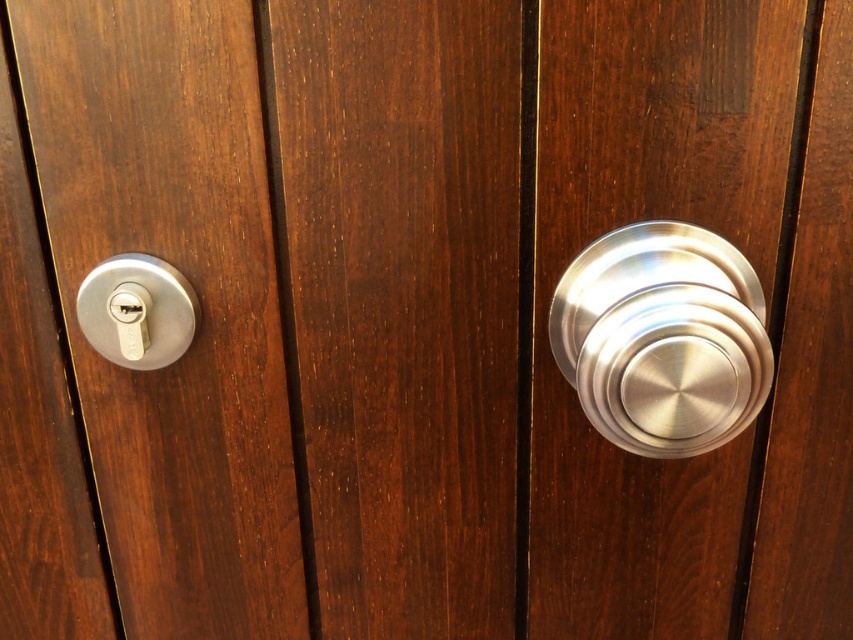
Identify the location of dark wood door at center. This screenshot has height=640, width=853. [399, 305].

Which is more to the right, dark wood door at center or satin silver door handle at right?

From the viewer's perspective, satin silver door handle at right appears more on the right side.

What do you see at coordinates (399, 305) in the screenshot? I see `dark wood door at center` at bounding box center [399, 305].

Identify the location of dark wood door at center. The image size is (853, 640). (399, 305).

Image resolution: width=853 pixels, height=640 pixels. Describe the element at coordinates (195, 291) in the screenshot. I see `satin nickel lock at left` at that location.

The image size is (853, 640). I want to click on satin nickel lock at left, so click(x=195, y=291).

Identify the location of satin nickel lock at left. The height and width of the screenshot is (640, 853). (195, 291).

Is satin silver door handle at right further to the viewer compared to matte silver lock at left?

No, it is in front of matte silver lock at left.

What do you see at coordinates (662, 339) in the screenshot? I see `satin silver door handle at right` at bounding box center [662, 339].

Who is more distant from viewer, [631,259] or [154,349]?

The point [154,349] is more distant.

This screenshot has width=853, height=640. What are the coordinates of `satin silver door handle at right` in the screenshot? It's located at pyautogui.click(x=662, y=339).